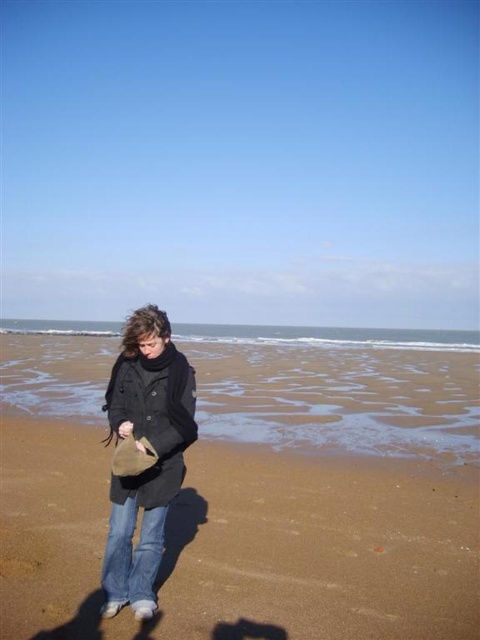
Question: Can you confirm if sandy brown beach at center is positioned to the right of denim at lower center?

Choices:
 (A) yes
 (B) no

Answer: (B)

Question: Which object appears closest to the camera in this image?

Choices:
 (A) denim at lower center
 (B) dark gray wool coat at center

Answer: (B)

Question: Is sandy brown beach at center thinner than denim at lower center?

Choices:
 (A) yes
 (B) no

Answer: (B)

Question: Which of these objects is positioned farthest from the dark gray wool coat at center?

Choices:
 (A) denim at lower center
 (B) sandy brown beach at center

Answer: (B)

Question: Does sandy brown beach at center lie behind dark gray wool coat at center?

Choices:
 (A) no
 (B) yes

Answer: (B)

Question: Which point is closer to the camera taking this photo?

Choices:
 (A) (126, 557)
 (B) (109, 577)
 (C) (33, 564)

Answer: (B)